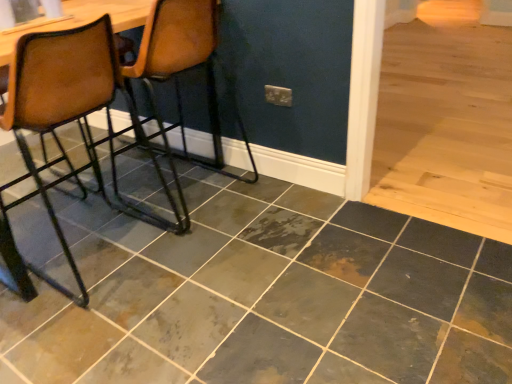
Question: Is marbled slate tile at center situated inside brown leather chair at left, arranged as the 2th chair when viewed from the right, or outside?

Choices:
 (A) inside
 (B) outside

Answer: (B)

Question: In the image, is marbled slate tile at center on the left side or the right side of brown leather chair at left, arranged as the 2th chair when viewed from the right?

Choices:
 (A) right
 (B) left

Answer: (A)

Question: Which object is positioned closest to the marbled slate tile at center?

Choices:
 (A) brown leather chair at left, which is counted as the 2th chair, starting from the left
 (B) brown leather chair at left, arranged as the 2th chair when viewed from the right

Answer: (B)

Question: Considering the real-world distances, which object is farthest from the marbled slate tile at center?

Choices:
 (A) brown leather chair at left, which is counted as the 2th chair, starting from the left
 (B) brown leather chair at left, arranged as the 2th chair when viewed from the right

Answer: (A)